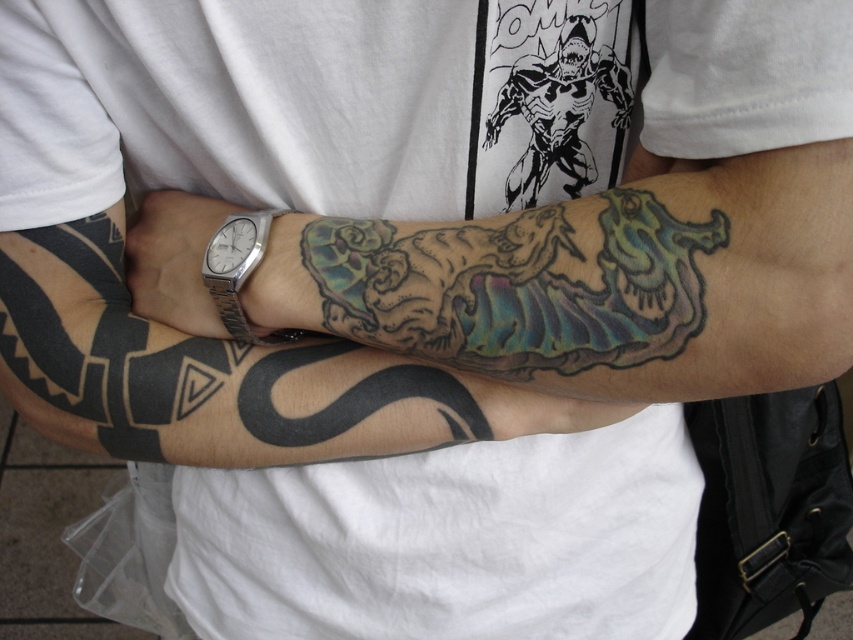
You are a tattoo artist assessing the space between the multicolored ink dragon at center and the silver metallic watch at left. Can you fit a small heart tattoo between them?

The multicolored ink dragon at center is wider than the silver metallic watch at left, so there might be sufficient space to fit a small heart tattoo between them, but it depends on the exact dimensions of the available area.

You are a tattoo artist examining the image of a person with a multicolored ink dragon at center and a silver metallic watch at left. The client wants to add a new tattoo between these two items. Based on their current positions, which object would the new tattoo be closer to?

The multicolored ink dragon at center is positioned under the silver metallic watch at left, so the new tattoo would be closer to the multicolored ink dragon at center since it is located below the watch.

You are a photographer adjusting your camera to capture the multicolored ink dragon at center and the silver metallic watch at center. Which object should you focus on first if you want to ensure both are in frame without moving the camera?

You should focus on the multicolored ink dragon at center first because it is positioned to the right of the silver metallic watch at center, so adjusting focus to the dragon ensures the watch remains within the frame.